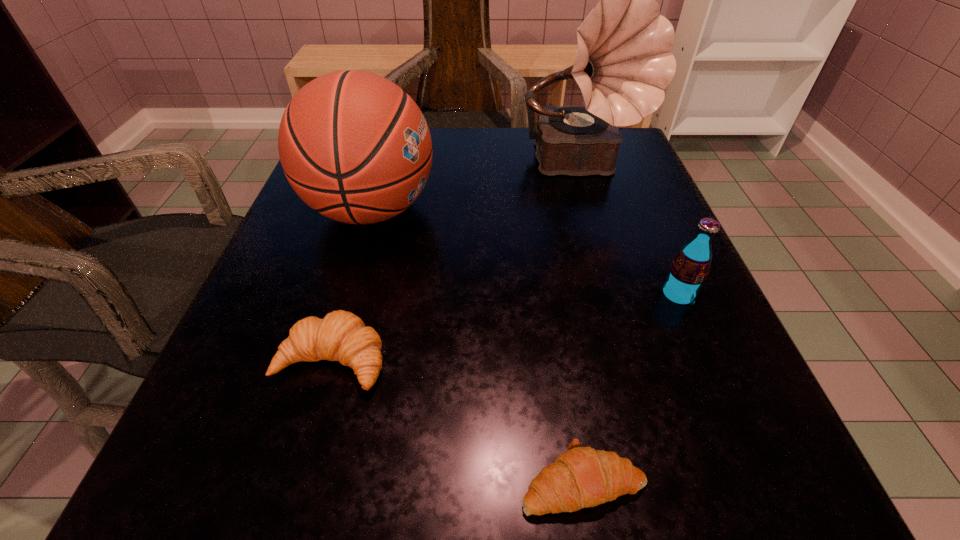
Find the location of `record player`. record player is located at coordinates (623, 63).

This screenshot has width=960, height=540. Find the location of `basketball`. basketball is located at coordinates (354, 146).

Identify the location of the third farthest object. This screenshot has width=960, height=540. (689, 270).

Identify the location of soda. This screenshot has height=540, width=960. (689, 270).

Locate an element on the screen. the taller crescent roll is located at coordinates (341, 336).

At what (x,y) coordinates should I click in order to perform the action: click on the left crescent roll. Please return your answer as a coordinate pair (x, y). The height and width of the screenshot is (540, 960). Looking at the image, I should click on (341, 336).

Identify the location of the shortest object. (581, 477).

This screenshot has width=960, height=540. I want to click on the nearer crescent roll, so click(x=581, y=477).

Where is `vacant region located 0.050m from the horn of the tallest object`? vacant region located 0.050m from the horn of the tallest object is located at coordinates (597, 217).

This screenshot has height=540, width=960. Find the location of `vacant space situated 0.230m on the logo side of the second tallest object`. vacant space situated 0.230m on the logo side of the second tallest object is located at coordinates (555, 210).